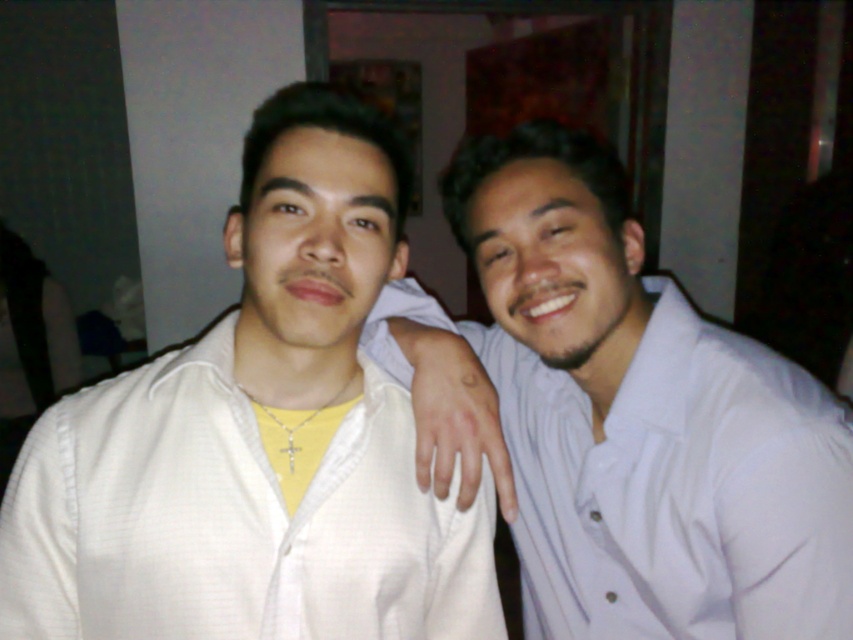
You are a photographer standing in front of the two people in the image. You want to take a photo of the white textured shirt at left without including the person on the right. Can you step back enough to do so? Explain your reasoning.

The white textured shirt at left and viewer are 26.59 inches apart from each other. Since the photographer is currently 26.59 inches away from the white textured shirt at left, stepping back would increase this distance. However, the person on the right is already close to the left individual, so stepping back might still allow capturing the white textured shirt at left while excluding the right person, depending on the camera angle and lens used. However, the description does not provide information about

You are a photographer setting up a shoot and need to position two models wearing the white textured shirt at left and the white striped shirt at right. According to the scene, which model should stand on your left side to maintain their original positions relative to each other?

The model wearing the white textured shirt at left should stand on your left side because the white textured shirt at left is to the left of the white striped shirt at right, maintaining their original positions.